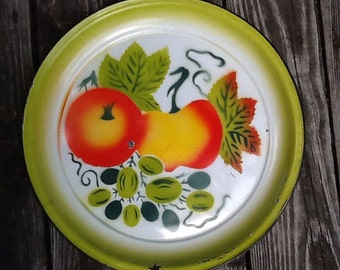
At what (x,y) coordinates should I click in order to perform the action: click on white plate center. Please return your answer as a coordinate pair (x, y). Looking at the image, I should click on (248, 205).